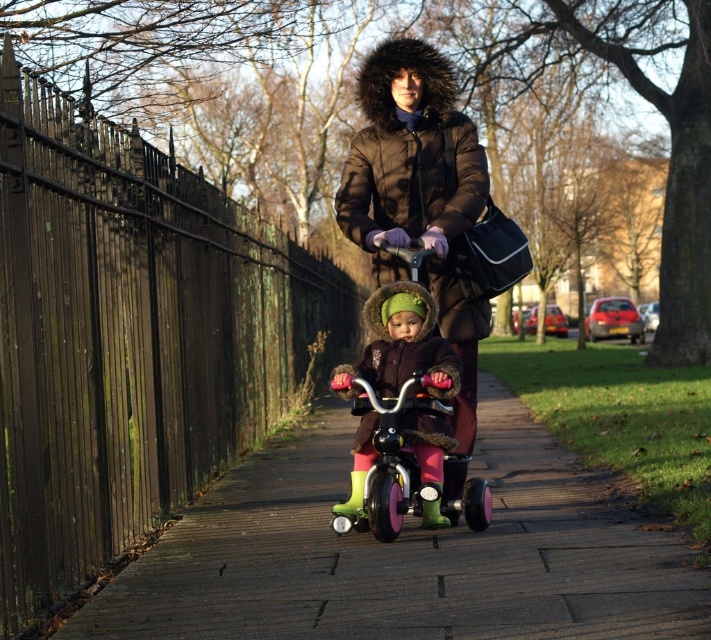
Question: Which point is closer to the camera?

Choices:
 (A) pink rubber tricycle at center
 (B) matte pink tricycle at center
 (C) dark brown wooden fence at left

Answer: (A)

Question: Does dark brown wooden fence at left lie behind dark brown quilted jacket at center?

Choices:
 (A) yes
 (B) no

Answer: (B)

Question: Is dark brown wooden fence at left further to camera compared to matte pink tricycle at center?

Choices:
 (A) no
 (B) yes

Answer: (A)

Question: Which object appears closest to the camera in this image?

Choices:
 (A) pink rubber tricycle at center
 (B) dark brown quilted jacket at center
 (C) dark brown wooden fence at left
 (D) matte pink tricycle at center

Answer: (A)

Question: Can you confirm if dark brown quilted jacket at center is positioned below matte pink tricycle at center?

Choices:
 (A) no
 (B) yes

Answer: (A)

Question: Which of the following is the farthest from the observer?

Choices:
 (A) dark brown quilted jacket at center
 (B) pink rubber tricycle at center
 (C) dark brown wooden fence at left
 (D) matte pink tricycle at center

Answer: (A)